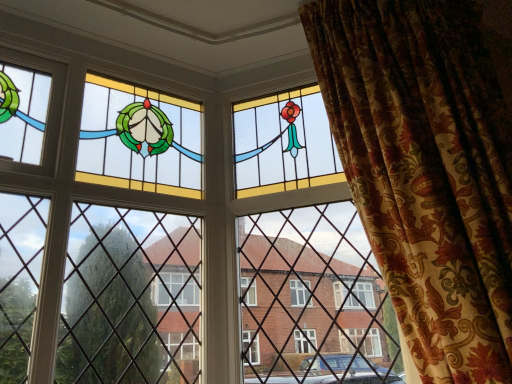
Question: Is stained glass window at center oriented away from velvet floral curtain at right?

Choices:
 (A) yes
 (B) no

Answer: (B)

Question: Is stained glass window at center to the right of velvet floral curtain at right from the viewer's perspective?

Choices:
 (A) yes
 (B) no

Answer: (B)

Question: Considering the relative sizes of stained glass window at center and velvet floral curtain at right in the image provided, is stained glass window at center wider than velvet floral curtain at right?

Choices:
 (A) yes
 (B) no

Answer: (B)

Question: From the image's perspective, is stained glass window at center on top of velvet floral curtain at right?

Choices:
 (A) yes
 (B) no

Answer: (B)

Question: Considering the relative sizes of stained glass window at center and velvet floral curtain at right in the image provided, is stained glass window at center thinner than velvet floral curtain at right?

Choices:
 (A) yes
 (B) no

Answer: (A)

Question: Can you confirm if stained glass window at center is positioned to the left of velvet floral curtain at right?

Choices:
 (A) no
 (B) yes

Answer: (B)

Question: Is velvet floral curtain at right turned away from stained glass window at center?

Choices:
 (A) no
 (B) yes

Answer: (A)

Question: Does velvet floral curtain at right appear on the left side of stained glass window at center?

Choices:
 (A) no
 (B) yes

Answer: (A)

Question: From a real-world perspective, is velvet floral curtain at right under stained glass window at center?

Choices:
 (A) yes
 (B) no

Answer: (A)

Question: From the image's perspective, is velvet floral curtain at right above stained glass window at center?

Choices:
 (A) yes
 (B) no

Answer: (A)

Question: Could you tell me if velvet floral curtain at right is turned towards stained glass window at center?

Choices:
 (A) no
 (B) yes

Answer: (A)

Question: Does velvet floral curtain at right come in front of stained glass window at center?

Choices:
 (A) yes
 (B) no

Answer: (A)

Question: In terms of width, does stained glass window at center look wider or thinner when compared to velvet floral curtain at right?

Choices:
 (A) thin
 (B) wide

Answer: (A)